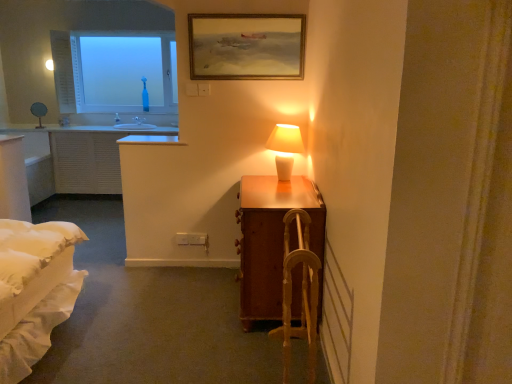
What do you see at coordinates (301, 290) in the screenshot? The height and width of the screenshot is (384, 512). I see `wooden armchair at center` at bounding box center [301, 290].

The height and width of the screenshot is (384, 512). Describe the element at coordinates (247, 46) in the screenshot. I see `wooden framed painting at upper center` at that location.

What do you see at coordinates (272, 240) in the screenshot?
I see `wooden suitcase at right` at bounding box center [272, 240].

Where is `white ceramic lamp at upper right`? white ceramic lamp at upper right is located at coordinates (285, 148).

The image size is (512, 384). Find the location of `transparent glass bottle at upper left`. transparent glass bottle at upper left is located at coordinates (120, 73).

In the image, there is a wooden suitcase at right. What are the coordinates of `picture frame above it (from the image's perspective)` in the screenshot? It's located at (247, 46).

Can you see wooden framed painting at upper center touching wooden suitcase at right?

There is a gap between wooden framed painting at upper center and wooden suitcase at right.

Is the depth of wooden framed painting at upper center greater than that of wooden suitcase at right?

Yes, wooden framed painting at upper center is further from the viewer.

From a real-world perspective, is wooden framed painting at upper center under wooden suitcase at right?

Actually, wooden framed painting at upper center is physically above wooden suitcase at right in the real world.

Based on the photo, is wooden framed painting at upper center to the right of transparent glass bottle at upper left from the viewer's perspective?

Indeed, wooden framed painting at upper center is positioned on the right side of transparent glass bottle at upper left.

From a real-world perspective, is wooden framed painting at upper center physically located above or below transparent glass bottle at upper left?

In terms of real-world spatial position, wooden framed painting at upper center is above transparent glass bottle at upper left.

From the image's perspective, between wooden framed painting at upper center and transparent glass bottle at upper left, which one is located above?

From the image's view, transparent glass bottle at upper left is above.

How distant is white ceramic lamp at upper right from wooden suitcase at right?

They are 17.98 inches apart.

Does point (289, 173) come in front of point (317, 240)?

No, it is behind (317, 240).

In the image, is white ceramic lamp at upper right positioned in front of or behind wooden suitcase at right?

Visually, white ceramic lamp at upper right is located behind wooden suitcase at right.

How different are the orientations of white ceramic lamp at upper right and wooden suitcase at right in degrees?

1.61 degrees separate the facing orientations of white ceramic lamp at upper right and wooden suitcase at right.

Based on the photo, what's the angular difference between wooden framed painting at upper center and white ceramic lamp at upper right's facing directions?

The angular difference between wooden framed painting at upper center and white ceramic lamp at upper right is 90 degrees.

Is wooden framed painting at upper center aimed at white ceramic lamp at upper right?

No, wooden framed painting at upper center is not turned towards white ceramic lamp at upper right.

Is wooden framed painting at upper center smaller than white ceramic lamp at upper right?

Correct, wooden framed painting at upper center occupies less space than white ceramic lamp at upper right.

Which object is more forward, wooden framed painting at upper center or white ceramic lamp at upper right?

white ceramic lamp at upper right is more forward.

Between white ceramic lamp at upper right and transparent glass bottle at upper left, which one has less height?

white ceramic lamp at upper right is shorter.

Is white ceramic lamp at upper right outside of transparent glass bottle at upper left?

white ceramic lamp at upper right lies outside transparent glass bottle at upper left's area.

Find the location of `window that appears on the left of white ceramic lamp at upper right`. window that appears on the left of white ceramic lamp at upper right is located at coordinates (120, 73).

Is white ceramic lamp at upper right smaller than transparent glass bottle at upper left?

Indeed, white ceramic lamp at upper right has a smaller size compared to transparent glass bottle at upper left.

Is wooden armchair at center at the left side of wooden framed painting at upper center?

No.

Is the position of wooden armchair at center less distant than that of wooden framed painting at upper center?

Yes, wooden armchair at center is in front of wooden framed painting at upper center.

From the image's perspective, is wooden armchair at center under wooden framed painting at upper center?

Yes, from the image's perspective, wooden armchair at center is beneath wooden framed painting at upper center.

In terms of height, does wooden armchair at center look taller or shorter compared to wooden framed painting at upper center?

wooden armchair at center is taller than wooden framed painting at upper center.

From the image's perspective, is wooden suitcase at right above or below white ceramic lamp at upper right?

Based on their image positions, wooden suitcase at right is located beneath white ceramic lamp at upper right.

Considering the relative positions of wooden suitcase at right and white ceramic lamp at upper right in the image provided, is wooden suitcase at right to the right of white ceramic lamp at upper right from the viewer's perspective?

No, wooden suitcase at right is not to the right of white ceramic lamp at upper right.

Can we say wooden suitcase at right lies outside white ceramic lamp at upper right?

That's correct, wooden suitcase at right is outside of white ceramic lamp at upper right.

Identify the location of picture frame behind the wooden suitcase at right. This screenshot has height=384, width=512. (247, 46).

In the image, there is a transparent glass bottle at upper left. Where is `picture frame below it (from the image's perspective)`? This screenshot has width=512, height=384. picture frame below it (from the image's perspective) is located at coordinates (247, 46).

Looking at this image, when comparing their distances from wooden armchair at center, does wooden framed painting at upper center or wooden suitcase at right seem further?

Based on the image, wooden framed painting at upper center appears to be further to wooden armchair at center.

Considering their positions, is wooden framed painting at upper center positioned further to transparent glass bottle at upper left than wooden suitcase at right?

wooden suitcase at right lies further to transparent glass bottle at upper left than the other object.

Considering their positions, is transparent glass bottle at upper left positioned further to white ceramic lamp at upper right than wooden framed painting at upper center?

Among the two, transparent glass bottle at upper left is located further to white ceramic lamp at upper right.

Looking at the image, which one is located closer to wooden framed painting at upper center, wooden suitcase at right or transparent glass bottle at upper left?

Based on the image, wooden suitcase at right appears to be nearer to wooden framed painting at upper center.

Based on their spatial positions, is transparent glass bottle at upper left or wooden suitcase at right closer to white ceramic lamp at upper right?

wooden suitcase at right is positioned closer to the anchor white ceramic lamp at upper right.

Based on their spatial positions, is wooden armchair at center or wooden framed painting at upper center further from wooden suitcase at right?

wooden framed painting at upper center is positioned further to the anchor wooden suitcase at right.

Looking at the image, which one is located closer to wooden armchair at center, transparent glass bottle at upper left or wooden suitcase at right?

Among the two, wooden suitcase at right is located nearer to wooden armchair at center.

From the image, which object appears to be farther from transparent glass bottle at upper left, wooden armchair at center or white ceramic lamp at upper right?

The object further to transparent glass bottle at upper left is wooden armchair at center.

Identify the location of table that lies between wooden framed painting at upper center and wooden armchair at center from top to bottom. pyautogui.click(x=272, y=240).

This screenshot has height=384, width=512. I want to click on table lamp positioned between wooden suitcase at right and transparent glass bottle at upper left from near to far, so click(285, 148).

The height and width of the screenshot is (384, 512). Identify the location of table between wooden armchair at center and white ceramic lamp at upper right in the front-back direction. tap(272, 240).

Where is `picture frame between wooden armchair at center and transparent glass bottle at upper left along the z-axis`? The image size is (512, 384). picture frame between wooden armchair at center and transparent glass bottle at upper left along the z-axis is located at coordinates (247, 46).